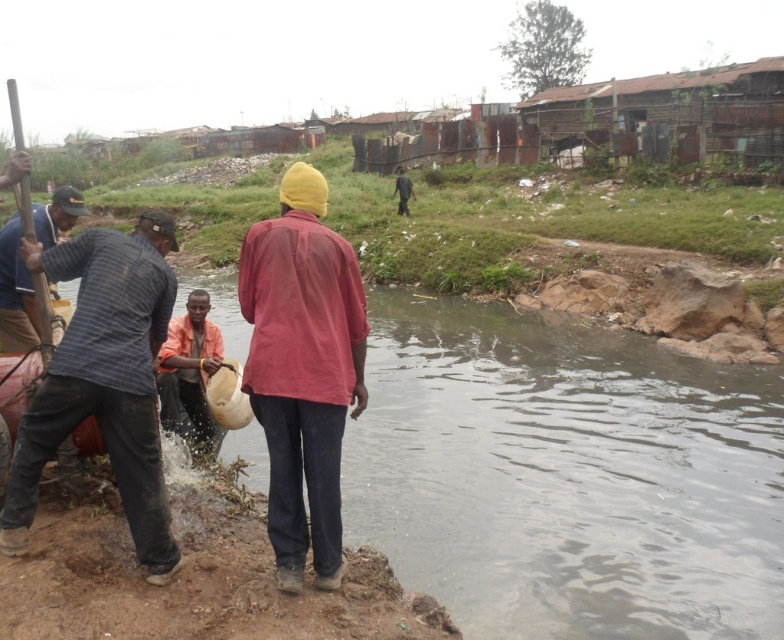
Question: Which point appears closest to the camera in this image?

Choices:
 (A) (303, 378)
 (B) (176, 404)

Answer: (A)

Question: Which object is positioned farthest from the striped cotton shirt at left?

Choices:
 (A) striped fabric shirt at left
 (B) orange fabric bag at lower left
 (C) matte red shirt at center
 (D) clear water at river right

Answer: (D)

Question: Observing the image, what is the correct spatial positioning of matte red shirt at center in reference to striped cotton shirt at left?

Choices:
 (A) right
 (B) left

Answer: (A)

Question: Among these points, which one is farthest from the camera?

Choices:
 (A) (583, 349)
 (B) (56, 209)

Answer: (A)

Question: Can you confirm if clear water at river right is positioned above orange fabric bag at lower left?

Choices:
 (A) yes
 (B) no

Answer: (A)

Question: Is striped cotton shirt at left bigger than orange fabric bag at lower left?

Choices:
 (A) yes
 (B) no

Answer: (A)